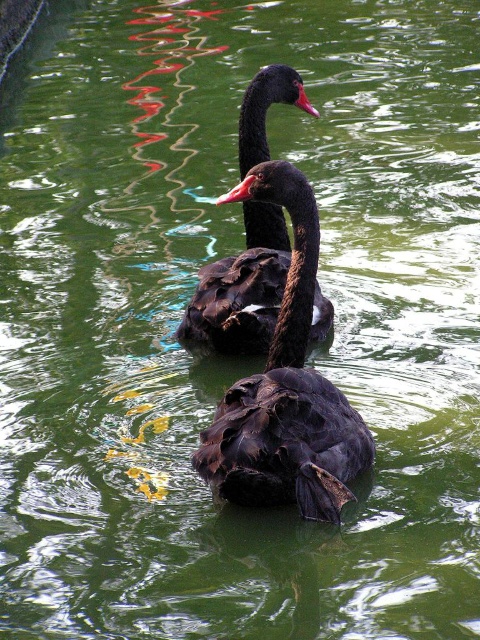
From the picture: Is shiny black swan at center behind matte black swan at upper center?

No, it is in front of matte black swan at upper center.

What do you see at coordinates (286, 388) in the screenshot? I see `shiny black swan at center` at bounding box center [286, 388].

Where is `shiny black swan at center`? shiny black swan at center is located at coordinates (286, 388).